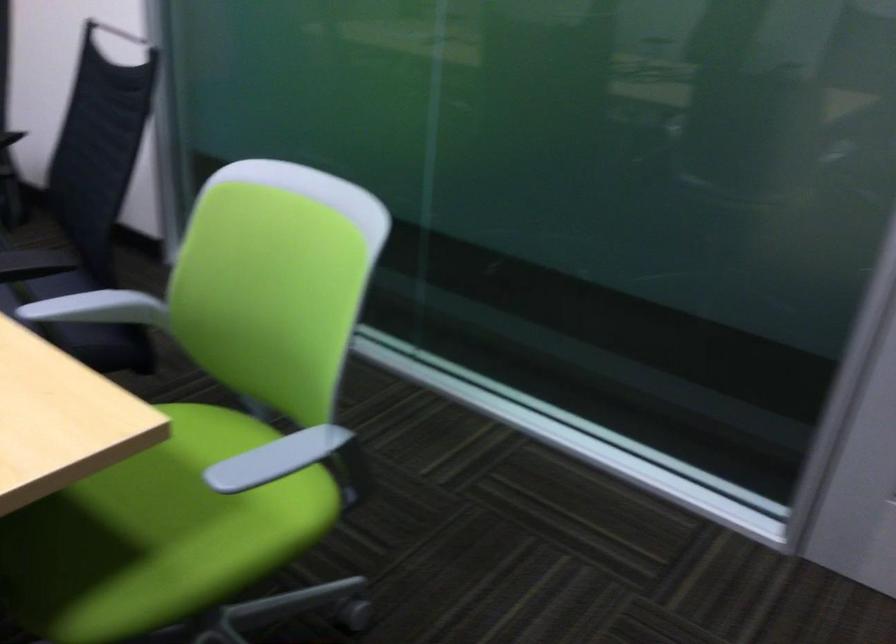
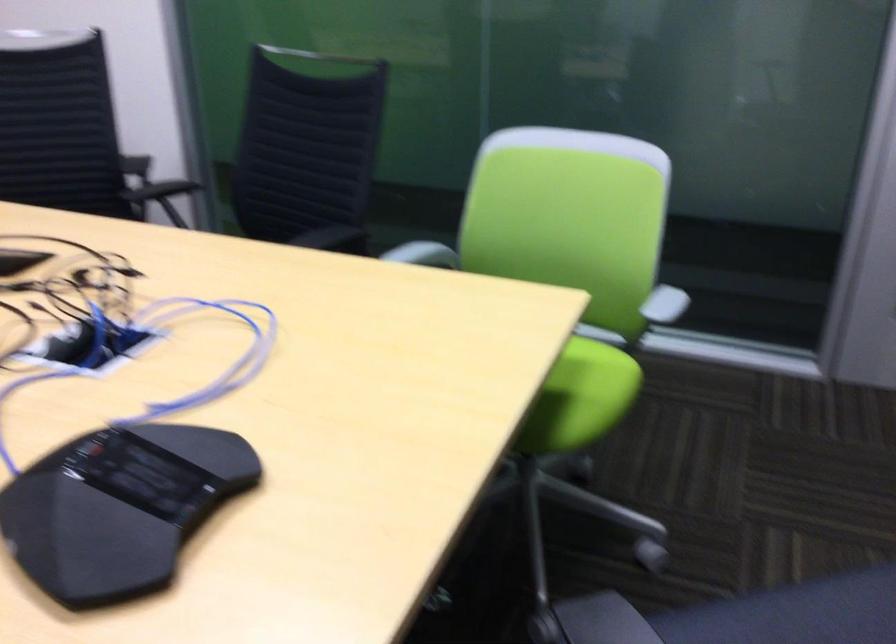
Locate, in the second image, the point that corresponds to [195,560] in the first image.

(590, 392)